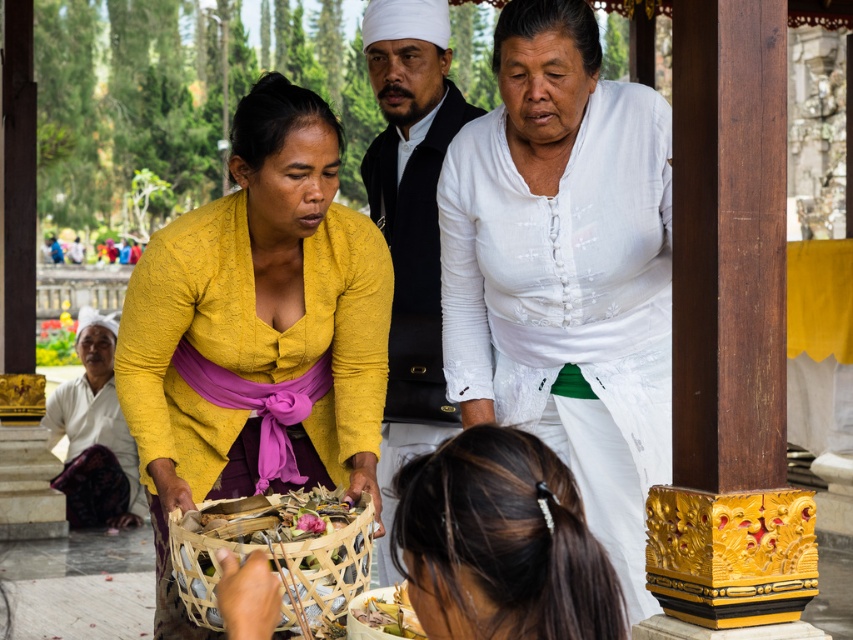
Between matte black jacket at center and purple silk robe at lower left, which one has more height?

matte black jacket at center

Is matte black jacket at center taller than purple silk robe at lower left?

Indeed, matte black jacket at center has a greater height compared to purple silk robe at lower left.

Is point (410, 76) behind point (61, 420)?

No, it is in front of (61, 420).

Where is `matte black jacket at center`? This screenshot has width=853, height=640. matte black jacket at center is located at coordinates (410, 221).

Measure the distance from matte yellow blouse at center to white sheer blouse at center.

A distance of 1.25 meters exists between matte yellow blouse at center and white sheer blouse at center.

Is matte yellow blouse at center above white sheer blouse at center?

Incorrect, matte yellow blouse at center is not positioned above white sheer blouse at center.

The width and height of the screenshot is (853, 640). Identify the location of matte yellow blouse at center. (257, 332).

At what (x,y) coordinates should I click in order to perform the action: click on matte yellow blouse at center. Please return your answer as a coordinate pair (x, y). This screenshot has height=640, width=853. Looking at the image, I should click on (257, 332).

Between white sheer blouse at center and bamboo woven basket at center, which one is positioned lower?

bamboo woven basket at center

Does point (492, 362) come behind point (294, 538)?

Yes.

The height and width of the screenshot is (640, 853). In order to click on white sheer blouse at center in this screenshot , I will do `click(570, 305)`.